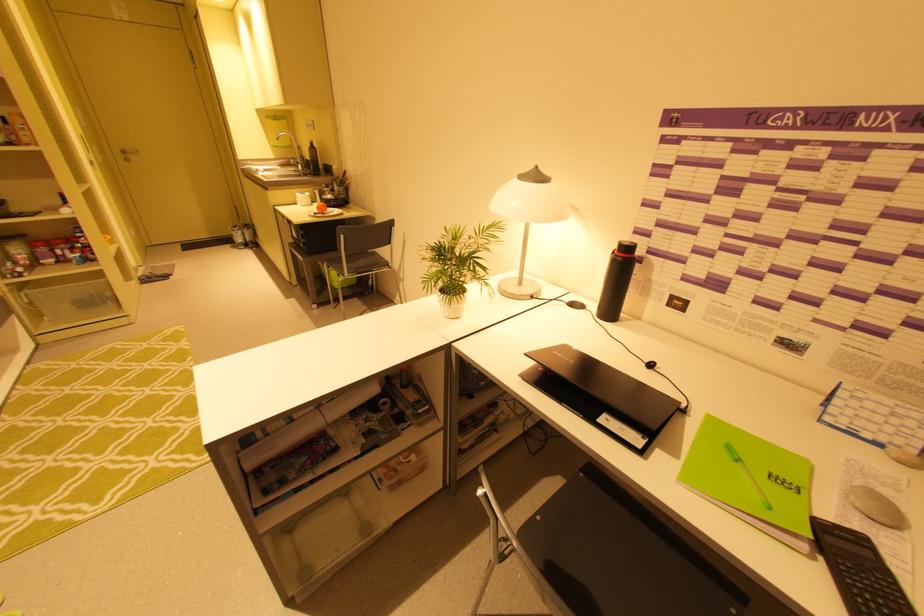
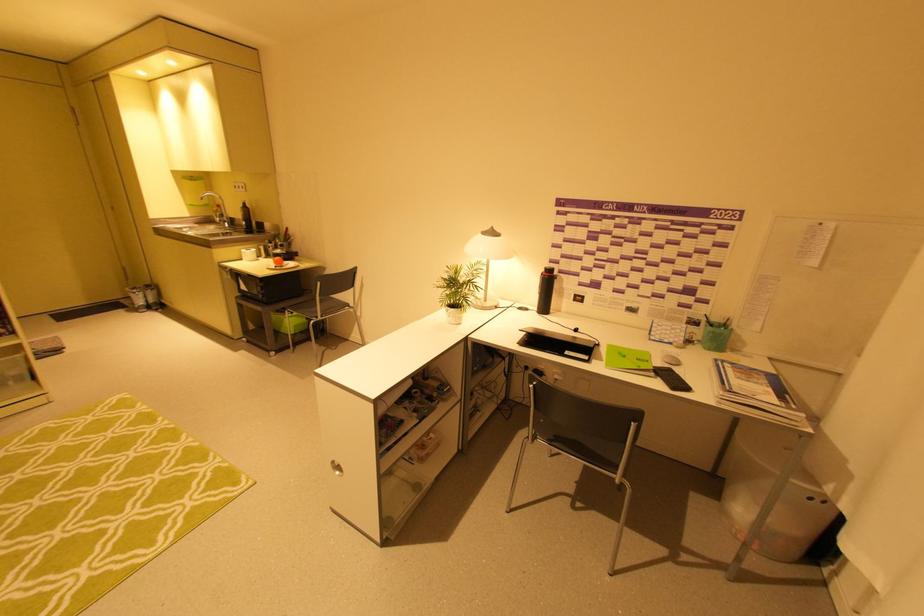
In the second image, find the point that corresponds to (714,419) in the first image.

(614, 346)